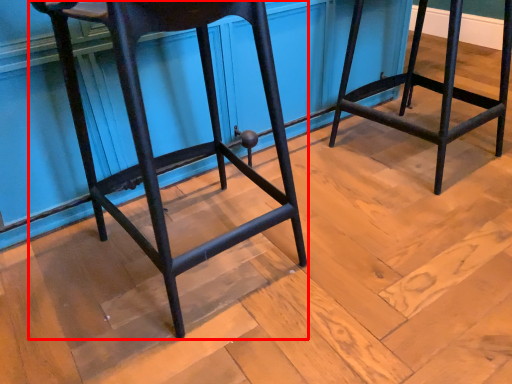
Question: In this image, where is furniture (annotated by the red box) located relative to furniture?

Choices:
 (A) right
 (B) left

Answer: (B)